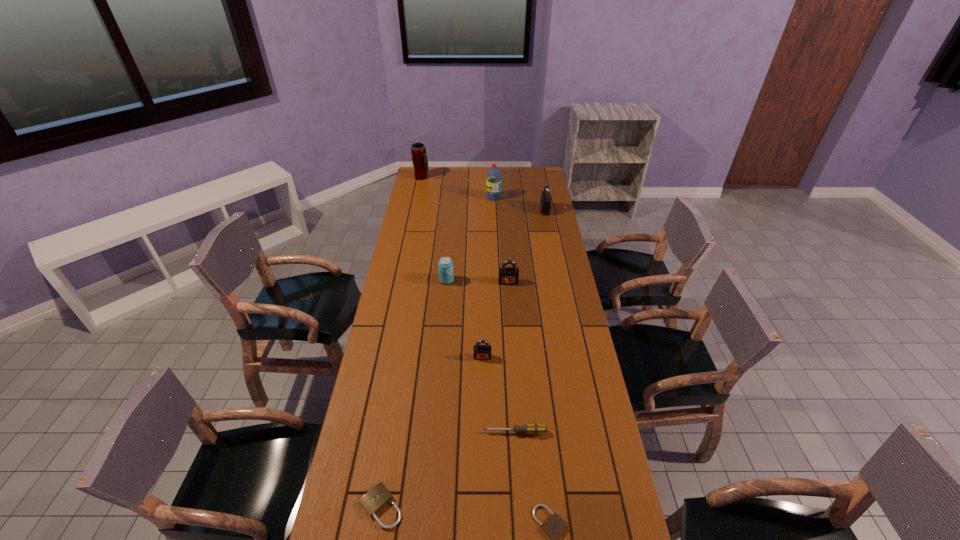
Find the location of a particular element. This screenshot has width=960, height=540. free space between the second gray padlock from left to right and the farthest padlock is located at coordinates (526, 246).

This screenshot has width=960, height=540. Find the location of `vacant space in between the red thermos bottle and the gray screwdriver`. vacant space in between the red thermos bottle and the gray screwdriver is located at coordinates (468, 305).

The image size is (960, 540). Find the location of `vacant space that's between the second shortest padlock and the red thermos bottle`. vacant space that's between the second shortest padlock and the red thermos bottle is located at coordinates (401, 342).

At what (x,y) coordinates should I click in order to perform the action: click on vacant region between the farthest object and the beer can. Please return your answer as a coordinate pair (x, y). This screenshot has height=540, width=960. Looking at the image, I should click on (434, 229).

Identify which object is located as the third nearest to the sixth farthest object. Please provide its 2D coordinates. Your answer should be formatted as a tuple, i.e. [(x, y)], where the tuple contains the x and y coordinates of a point satisfying the conditions above.

[(445, 265)]

Where is `object that is the eighth closest to the seventh object from right to left`? The height and width of the screenshot is (540, 960). object that is the eighth closest to the seventh object from right to left is located at coordinates (555, 524).

Locate which padlock is the second closest to the gray screwdriver. Please provide its 2D coordinates. Your answer should be formatted as a tuple, i.e. [(x, y)], where the tuple contains the x and y coordinates of a point satisfying the conditions above.

[(481, 352)]

The width and height of the screenshot is (960, 540). Identify the location of the closest padlock relative to the rightmost padlock. (507, 275).

Choose which gray padlock is the second nearest neighbor to the farthest gray padlock. Please provide its 2D coordinates. Your answer should be formatted as a tuple, i.e. [(x, y)], where the tuple contains the x and y coordinates of a point satisfying the conditions above.

[(481, 352)]

Find the location of `gray padlock identified as the closest to the third object from left to right`. gray padlock identified as the closest to the third object from left to right is located at coordinates click(x=507, y=275).